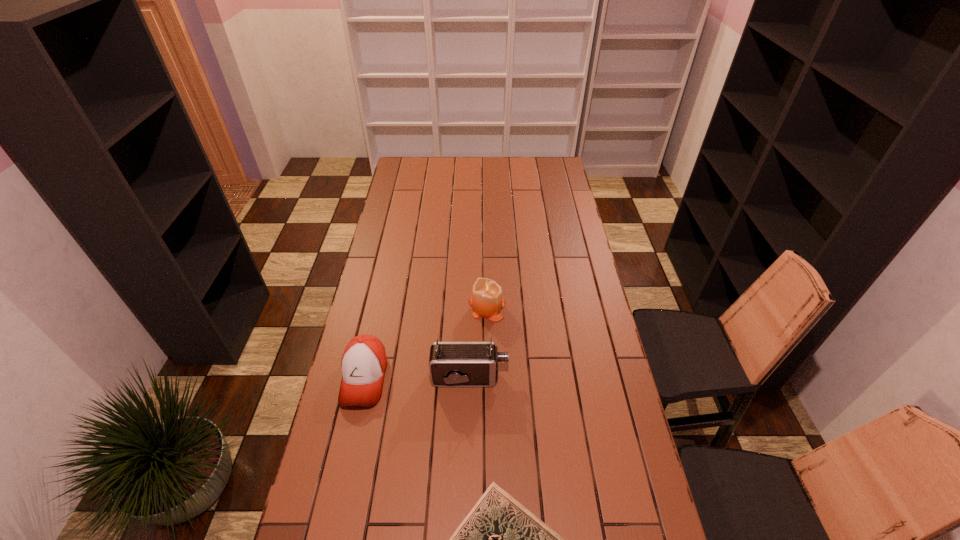
Where is `free region at the right edge of the desktop`? free region at the right edge of the desktop is located at coordinates (554, 262).

This screenshot has height=540, width=960. I want to click on vacant space that is in between the third tallest object and the candle, so click(x=425, y=342).

Where is `empty space between the farthest object and the baseball cap`? The image size is (960, 540). empty space between the farthest object and the baseball cap is located at coordinates (425, 342).

Where is `vacant space in between the leftmost object and the tallest object`? This screenshot has width=960, height=540. vacant space in between the leftmost object and the tallest object is located at coordinates (417, 377).

Locate an element on the screen. free space between the tallest object and the candle is located at coordinates (478, 342).

At what (x,y) coordinates should I click in order to perform the action: click on vacant space that's between the third tallest object and the tallest object. Please return your answer as a coordinate pair (x, y). The image size is (960, 540). Looking at the image, I should click on (417, 377).

Where is `object that is the closest to the camcorder`? This screenshot has width=960, height=540. object that is the closest to the camcorder is located at coordinates (363, 364).

The image size is (960, 540). In order to click on object that can be found as the closest to the candle in this screenshot , I will do `click(451, 364)`.

Where is `vacant space that satisfies the following two spatial constraints: 1. at the lens of the tallest object; 2. on the front-facing side of the leftmost object`? The image size is (960, 540). vacant space that satisfies the following two spatial constraints: 1. at the lens of the tallest object; 2. on the front-facing side of the leftmost object is located at coordinates (469, 377).